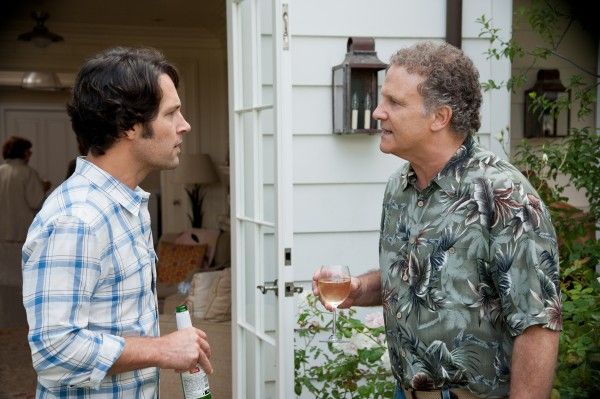
Where is `pillows on couch`? pillows on couch is located at coordinates (209, 302), (182, 265).